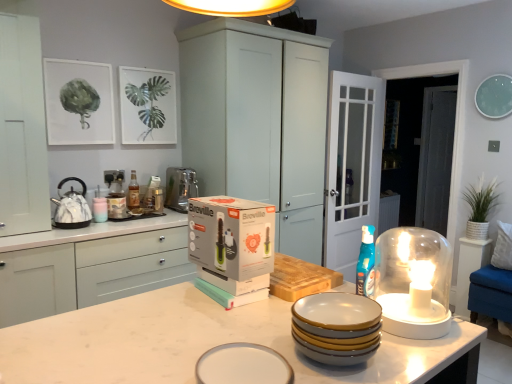
Question: Considering the relative sizes of satin silver appliance at left and marble/textured kettle at left in the image provided, is satin silver appliance at left wider than marble/textured kettle at left?

Choices:
 (A) no
 (B) yes

Answer: (B)

Question: Does satin silver appliance at left come behind marble/textured kettle at left?

Choices:
 (A) yes
 (B) no

Answer: (A)

Question: From a real-world perspective, does satin silver appliance at left stand above marble/textured kettle at left?

Choices:
 (A) no
 (B) yes

Answer: (A)

Question: Is there a large distance between satin silver appliance at left and marble/textured kettle at left?

Choices:
 (A) yes
 (B) no

Answer: (B)

Question: Does satin silver appliance at left have a greater height compared to marble/textured kettle at left?

Choices:
 (A) yes
 (B) no

Answer: (A)

Question: Can you confirm if satin silver appliance at left is thinner than marble/textured kettle at left?

Choices:
 (A) no
 (B) yes

Answer: (A)

Question: From a real-world perspective, is white matte cabinet at center, marked as the 1th cabinetry in a right-to-left arrangement, on top of teal plastic spray bottle at center-right?

Choices:
 (A) no
 (B) yes

Answer: (B)

Question: Is white matte cabinet at center, marked as the 1th cabinetry in a right-to-left arrangement, further to the viewer compared to teal plastic spray bottle at center-right?

Choices:
 (A) no
 (B) yes

Answer: (B)

Question: From the image's perspective, is white matte cabinet at center, marked as the 1th cabinetry in a right-to-left arrangement, under teal plastic spray bottle at center-right?

Choices:
 (A) yes
 (B) no

Answer: (B)

Question: Can you confirm if white matte cabinet at center, acting as the 3th cabinetry starting from the left, is smaller than teal plastic spray bottle at center-right?

Choices:
 (A) no
 (B) yes

Answer: (A)

Question: Is teal plastic spray bottle at center-right at the back of white matte cabinet at center, acting as the 3th cabinetry starting from the left?

Choices:
 (A) yes
 (B) no

Answer: (B)

Question: Would you consider white matte cabinet at center, acting as the 3th cabinetry starting from the left, to be distant from teal plastic spray bottle at center-right?

Choices:
 (A) no
 (B) yes

Answer: (B)

Question: Can you confirm if white matte cabinet at left, the 1th cabinetry from the left, is positioned to the left of transparent glass door at right, placed as the 2th glass door when sorted from left to right?

Choices:
 (A) no
 (B) yes

Answer: (B)